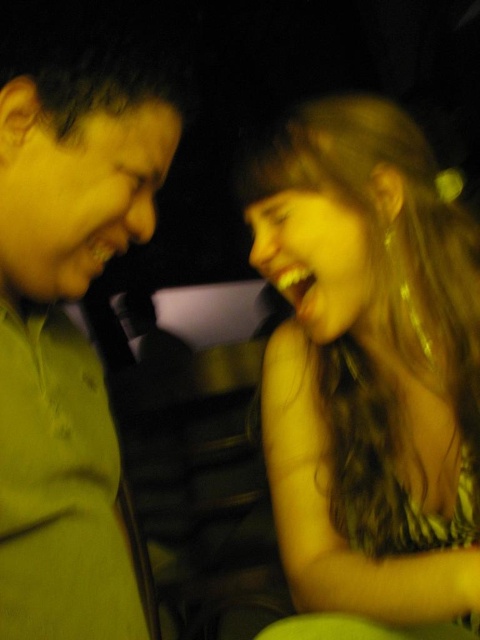
Question: Does shiny gold hair at right have a lesser width compared to green matte shirt at left?

Choices:
 (A) no
 (B) yes

Answer: (A)

Question: Can you confirm if shiny gold hair at right is smaller than green matte shirt at left?

Choices:
 (A) no
 (B) yes

Answer: (A)

Question: Does shiny gold hair at right have a smaller size compared to green matte shirt at left?

Choices:
 (A) yes
 (B) no

Answer: (B)

Question: Which object is closer to the camera taking this photo?

Choices:
 (A) green matte shirt at left
 (B) shiny gold hair at right

Answer: (A)